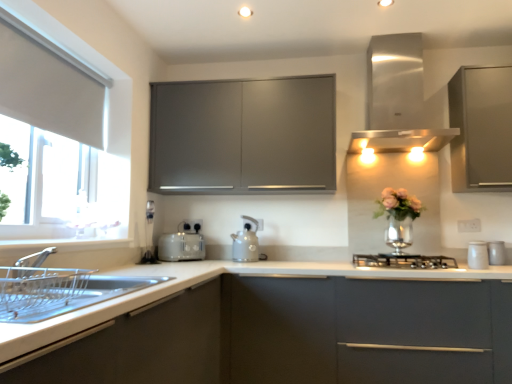
Image resolution: width=512 pixels, height=384 pixels. What do you see at coordinates (481, 128) in the screenshot?
I see `matte gray cabinet at upper right, the second cabinetry when ordered from back to front` at bounding box center [481, 128].

In order to face matte gray cabinet at center, which is the second cabinetry in right-to-left order, should I rotate leftwards or rightwards?

A 1.519 degree turn to the left will do.

The height and width of the screenshot is (384, 512). What do you see at coordinates (497, 253) in the screenshot? I see `white glossy canister at right, placed as the 1th appliance when sorted from right to left` at bounding box center [497, 253].

What do you see at coordinates (246, 242) in the screenshot?
I see `matte gray kettle at center` at bounding box center [246, 242].

Image resolution: width=512 pixels, height=384 pixels. I want to click on matte gray cabinet at upper right, the 2th cabinetry viewed from the front, so click(x=481, y=128).

In the scene shown: Are white ceramic jar at right, which is the 1th appliance in front-to-back order, and white matte countertop at center beside each other?

No, white ceramic jar at right, which is the 1th appliance in front-to-back order, is not touching white matte countertop at center.

Where is `countertop below the white ceramic jar at right, the second appliance in the left-to-right sequence (from a real-world perspective)`? The height and width of the screenshot is (384, 512). countertop below the white ceramic jar at right, the second appliance in the left-to-right sequence (from a real-world perspective) is located at coordinates click(x=279, y=328).

Considering the positions of objects white ceramic jar at right, acting as the second appliance starting from the right, and white matte countertop at center in the image provided, who is more to the right, white ceramic jar at right, acting as the second appliance starting from the right, or white matte countertop at center?

From the viewer's perspective, white ceramic jar at right, acting as the second appliance starting from the right, appears more on the right side.

Visually, is matte gray cabinet at upper right, the second cabinetry when ordered from back to front, positioned to the left or to the right of white glossy sink at lower left, which is the 1th cabinetry in left-to-right order?

Clearly, matte gray cabinet at upper right, the second cabinetry when ordered from back to front, is on the right of white glossy sink at lower left, which is the 1th cabinetry in left-to-right order, in the image.

Is matte gray cabinet at upper right, placed as the third cabinetry when sorted from left to right, touching white glossy sink at lower left, which ranks as the third cabinetry in back-to-front order?

No, matte gray cabinet at upper right, placed as the third cabinetry when sorted from left to right, is not making contact with white glossy sink at lower left, which ranks as the third cabinetry in back-to-front order.

From the image's perspective, which object appears higher, matte gray cabinet at upper right, the 2th cabinetry viewed from the front, or white glossy sink at lower left, placed as the first cabinetry when sorted from front to back?

From the image's view, matte gray cabinet at upper right, the 2th cabinetry viewed from the front, is above.

Can you confirm if matte gray cabinet at upper right, the first cabinetry from the right, is bigger than white glossy sink at lower left, which ranks as the third cabinetry in back-to-front order?

Incorrect, matte gray cabinet at upper right, the first cabinetry from the right, is not larger than white glossy sink at lower left, which ranks as the third cabinetry in back-to-front order.

From the image's perspective, which object appears higher, matte gray cabinet at center, the first cabinetry positioned from the back, or satin grey toaster at center, which is counted as the first appliance, starting from the left?

matte gray cabinet at center, the first cabinetry positioned from the back.

Which is more to the left, matte gray cabinet at center, which is the second cabinetry in right-to-left order, or satin grey toaster at center, which is counted as the first appliance, starting from the left?

satin grey toaster at center, which is counted as the first appliance, starting from the left.

From the picture: Relative to satin grey toaster at center, which is counted as the first appliance, starting from the left, is matte gray cabinet at center, which is the 3th cabinetry from front to back, in front or behind?

Clearly, matte gray cabinet at center, which is the 3th cabinetry from front to back, is in front of satin grey toaster at center, which is counted as the first appliance, starting from the left.

Considering the relative sizes of matte gray cabinet at center, marked as the 2th cabinetry in a left-to-right arrangement, and satin grey toaster at center, which is the first appliance in back-to-front order, in the image provided, is matte gray cabinet at center, marked as the 2th cabinetry in a left-to-right arrangement, thinner than satin grey toaster at center, which is the first appliance in back-to-front order,?

Incorrect, the width of matte gray cabinet at center, marked as the 2th cabinetry in a left-to-right arrangement, is not less than that of satin grey toaster at center, which is the first appliance in back-to-front order.

Could you tell me if satin grey toaster at center, arranged as the 3th appliance when viewed from the front, is facing white matte countertop at center?

No, satin grey toaster at center, arranged as the 3th appliance when viewed from the front, is not aimed at white matte countertop at center.

Considering their positions, is satin grey toaster at center, which is the first appliance in back-to-front order, located in front of or behind white matte countertop at center?

satin grey toaster at center, which is the first appliance in back-to-front order, is behind white matte countertop at center.

Locate an element on the screen. Image resolution: width=512 pixels, height=384 pixels. countertop that appears below the satin grey toaster at center, arranged as the 3th appliance when viewed from the right (from the image's perspective) is located at coordinates (279, 328).

From a real-world perspective, is satin grey toaster at center, which is the first appliance in back-to-front order, physically below white matte countertop at center?

No, from a real-world perspective, satin grey toaster at center, which is the first appliance in back-to-front order, is not under white matte countertop at center.

Identify the location of cabinetry that is the 2nd object located above the white fabric at left (from the image's perspective). (481, 128).

From a real-world perspective, is matte gray cabinet at upper right, placed as the third cabinetry when sorted from left to right, on top of white fabric at left?

Yes.

Considering the points (493, 116) and (38, 214), which point is in front, point (493, 116) or point (38, 214)?

The point (38, 214) is more forward.

Considering the relative sizes of matte gray cabinet at upper right, the first cabinetry from the right, and white fabric at left in the image provided, is matte gray cabinet at upper right, the first cabinetry from the right, wider than white fabric at left?

Correct, the width of matte gray cabinet at upper right, the first cabinetry from the right, exceeds that of white fabric at left.

Which of these two, black matte gas stove at center or matte gray cabinet at upper right, the second cabinetry when ordered from back to front, is thinner?

matte gray cabinet at upper right, the second cabinetry when ordered from back to front.

Considering their positions, is black matte gas stove at center located in front of or behind matte gray cabinet at upper right, placed as the third cabinetry when sorted from left to right?

Clearly, black matte gas stove at center is in front of matte gray cabinet at upper right, placed as the third cabinetry when sorted from left to right.

Is matte gray cabinet at upper right, placed as the third cabinetry when sorted from left to right, inside black matte gas stove at center?

Definitely not — matte gray cabinet at upper right, placed as the third cabinetry when sorted from left to right, is not inside black matte gas stove at center.

Is matte gray cabinet at center, the first cabinetry positioned from the back, not near white fabric window at left?

No, matte gray cabinet at center, the first cabinetry positioned from the back, is not far away from white fabric window at left.

Considering the positions of objects matte gray cabinet at center, which is the second cabinetry in right-to-left order, and white fabric window at left in the image provided, who is more to the left, matte gray cabinet at center, which is the second cabinetry in right-to-left order, or white fabric window at left?

white fabric window at left is more to the left.

Would you say white fabric window at left is part of matte gray cabinet at center, which is the 3th cabinetry from front to back,'s contents?

No.

From the image's perspective, between matte gray cabinet at center, the first cabinetry positioned from the back, and white fabric window at left, which one is located above?

matte gray cabinet at center, the first cabinetry positioned from the back, from the image's perspective.

I want to click on the 1st appliance directly above the white matte countertop at center (from a real-world perspective), so click(478, 255).

The image size is (512, 384). I want to click on cabinetry that is the 2nd one when counting upward from the white glossy sink at lower left, arranged as the 3th cabinetry when viewed from the right (from the image's perspective), so click(x=481, y=128).

Estimate the real-world distances between objects in this image. Which object is closer to satin grey toaster at center, which is counted as the first appliance, starting from the left, matte gray cabinet at center, marked as the 2th cabinetry in a left-to-right arrangement, or white matte countertop at center?

matte gray cabinet at center, marked as the 2th cabinetry in a left-to-right arrangement, is closer to satin grey toaster at center, which is counted as the first appliance, starting from the left.

Looking at the image, which one is located further to stainless steel vent at upper right, matte gray cabinet at upper right, placed as the third cabinetry when sorted from left to right, or white glossy sink at lower left, placed as the first cabinetry when sorted from front to back?

white glossy sink at lower left, placed as the first cabinetry when sorted from front to back, lies further to stainless steel vent at upper right than the other object.

Consider the image. When comparing their distances from white fabric at left, does black matte gas stove at center or satin grey toaster at center, which is counted as the first appliance, starting from the left, seem further?

black matte gas stove at center is further to white fabric at left.

Which object lies nearer to the anchor point matte gray cabinet at upper right, the 2th cabinetry viewed from the front, white glossy sink at lower left, which is the 1th cabinetry in left-to-right order, or white glossy canister at right, which is the second appliance in front-to-back order?

white glossy canister at right, which is the second appliance in front-to-back order, is positioned closer to the anchor matte gray cabinet at upper right, the 2th cabinetry viewed from the front.

From the image, which object appears to be farther from matte gray kettle at center, white ceramic jar at right, the second appliance in the left-to-right sequence, or matte gray cabinet at center, which is the second cabinetry in right-to-left order?

Among the two, white ceramic jar at right, the second appliance in the left-to-right sequence, is located further to matte gray kettle at center.

When comparing their distances from satin grey toaster at center, which is the first appliance in back-to-front order, does black matte gas stove at center or white glossy sink at lower left, which ranks as the third cabinetry in back-to-front order, seem further?

black matte gas stove at center lies further to satin grey toaster at center, which is the first appliance in back-to-front order, than the other object.

Which object lies nearer to the anchor point stainless steel vent at upper right, matte gray cabinet at center, which is the second cabinetry in right-to-left order, or matte gray kettle at center?

The object closer to stainless steel vent at upper right is matte gray cabinet at center, which is the second cabinetry in right-to-left order.

Which object lies further to the anchor point white fabric window at left, matte gray cabinet at upper right, the second cabinetry when ordered from back to front, or black matte gas stove at center?

The object further to white fabric window at left is matte gray cabinet at upper right, the second cabinetry when ordered from back to front.

You are a GUI agent. You are given a task and a screenshot of the screen. Output one action in this format:
    pyautogui.click(x=<x>, y=<y>)
    Task: Click on the countertop between matte gray cabinet at center, which is the 3th cabinetry from front to back, and white glossy canister at right, placed as the 1th appliance when sorted from right to left, from left to right
    The height and width of the screenshot is (384, 512).
    Given the screenshot: What is the action you would take?
    pyautogui.click(x=279, y=328)

This screenshot has height=384, width=512. What are the coordinates of `vent situated between matte gray kettle at center and matte gray cabinet at upper right, the first cabinetry from the right, from left to right` in the screenshot? It's located at (396, 98).

The width and height of the screenshot is (512, 384). In order to click on gas stove situated between white matte countertop at center and white glossy canister at right, placed as the 1th appliance when sorted from right to left, from left to right in this screenshot , I will do `click(404, 261)`.

At what (x,y) coordinates should I click in order to perform the action: click on vent situated between satin grey toaster at center, which is counted as the first appliance, starting from the left, and matte gray cabinet at upper right, the second cabinetry when ordered from back to front, from left to right. Please return your answer as a coordinate pair (x, y). Image resolution: width=512 pixels, height=384 pixels. Looking at the image, I should click on (396, 98).